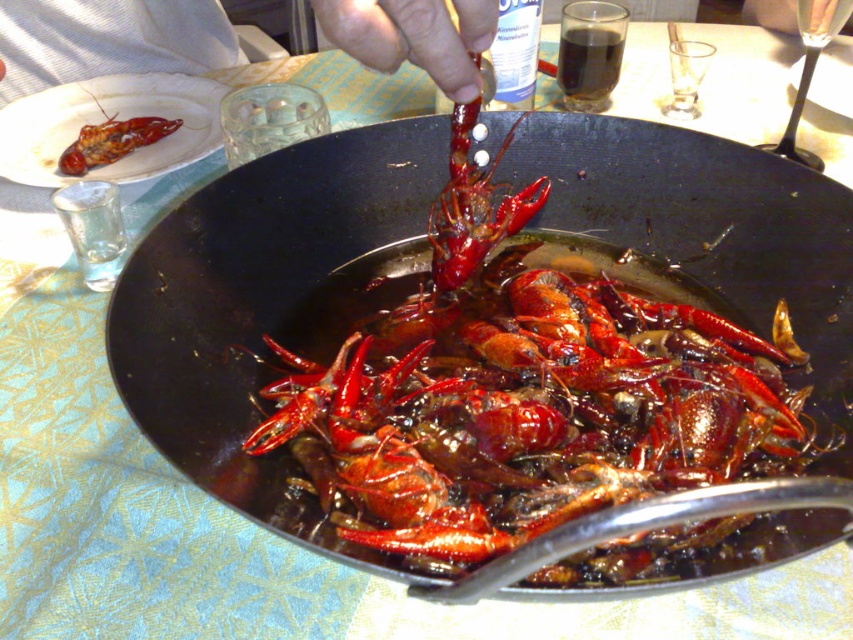
Question: Is smooth skin hand at upper center thinner than matte black plate at upper left?

Choices:
 (A) yes
 (B) no

Answer: (A)

Question: Which object appears farthest from the camera in this image?

Choices:
 (A) matte red lobster at upper left
 (B) matte black plate at upper left

Answer: (A)

Question: Does black matte wok at center have a larger size compared to matte black plate at upper left?

Choices:
 (A) yes
 (B) no

Answer: (A)

Question: Which point is farther to the camera?

Choices:
 (A) (465, 51)
 (B) (643, 168)

Answer: (B)

Question: Is black matte wok at center positioned at the back of matte red lobster at upper left?

Choices:
 (A) yes
 (B) no

Answer: (B)

Question: Among these points, which one is farthest from the camera?

Choices:
 (A) (589, 189)
 (B) (115, 88)

Answer: (B)